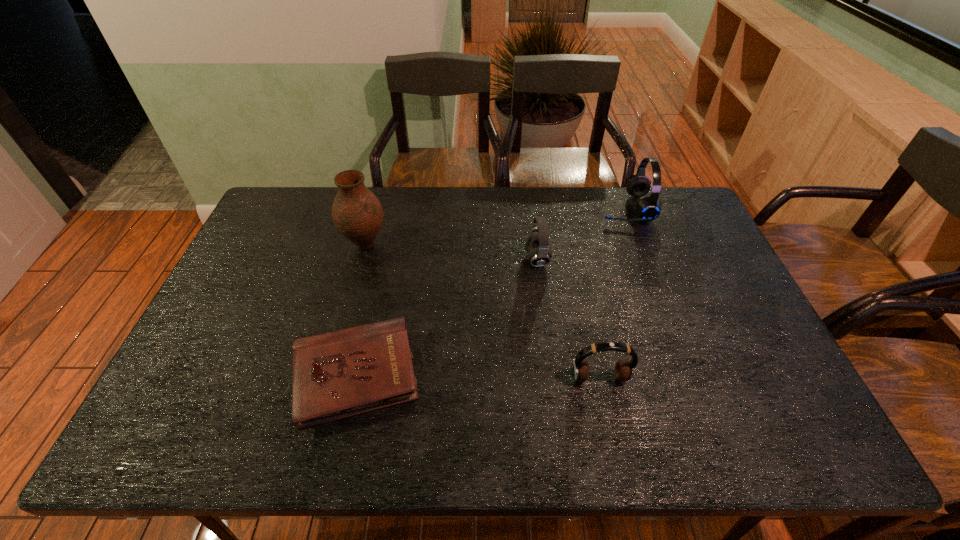
Where is `the tallest object`? the tallest object is located at coordinates (x=357, y=214).

Locate an element on the screen. Image resolution: width=960 pixels, height=540 pixels. the tallest headset is located at coordinates (648, 208).

I want to click on the rightmost headset, so click(x=648, y=208).

You are a GUI agent. You are given a task and a screenshot of the screen. Output one action in this format:
    pyautogui.click(x=<x>, y=<y>)
    Task: Click on the leftmost headset
    This screenshot has width=960, height=540.
    Given the screenshot: What is the action you would take?
    pyautogui.click(x=537, y=243)

You are a GUI agent. You are given a task and a screenshot of the screen. Output one action in this format:
    pyautogui.click(x=<x>, y=<y>)
    Task: Click on the third object from left to right
    The width and height of the screenshot is (960, 540).
    Given the screenshot: What is the action you would take?
    pyautogui.click(x=537, y=243)

In order to click on the second object from right to left in this screenshot , I will do `click(624, 370)`.

Find the location of a particular element. The height and width of the screenshot is (540, 960). the nearest headset is located at coordinates (624, 370).

At what (x,y) coordinates should I click in order to perform the action: click on hardback book. Please return your answer as a coordinate pair (x, y). This screenshot has width=960, height=540. Looking at the image, I should click on (338, 374).

Where is `vacant space located on the right of the tallest object`? This screenshot has width=960, height=540. vacant space located on the right of the tallest object is located at coordinates [x=404, y=245].

The image size is (960, 540). In order to click on vacant region located 0.090m on the ear cushions of the farthest headset in this screenshot , I will do [573, 208].